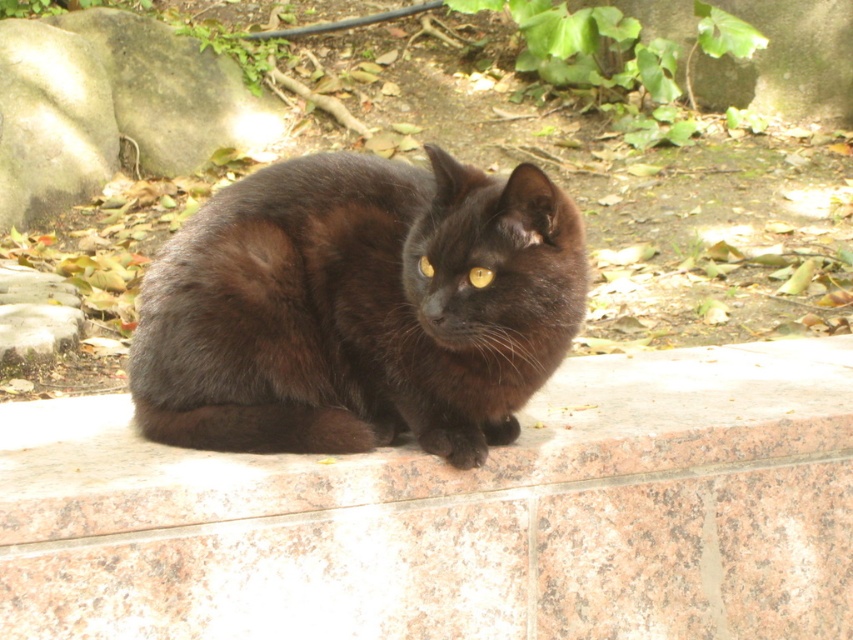
Is pink granite ledge at center smaller than golden shiny eye at center?

Incorrect, pink granite ledge at center is not smaller in size than golden shiny eye at center.

Can you confirm if pink granite ledge at center is positioned to the right of golden shiny eye at center?

Indeed, pink granite ledge at center is positioned on the right side of golden shiny eye at center.

Where is `pink granite ledge at center`? This screenshot has height=640, width=853. pink granite ledge at center is located at coordinates 457,516.

Between point (392, 260) and point (0, 198), which one is positioned in front?

Point (392, 260) is more forward.

Can you confirm if shiny black cat at center is shorter than gray rough rock at upper left?

Yes, shiny black cat at center is shorter than gray rough rock at upper left.

Which is behind, point (332, 253) or point (1, 204)?

Positioned behind is point (1, 204).

I want to click on shiny black cat at center, so click(357, 308).

Who is positioned more to the left, yellow shiny eye at center or golden shiny eye at center?

From the viewer's perspective, golden shiny eye at center appears more on the left side.

Can you confirm if yellow shiny eye at center is bigger than golden shiny eye at center?

Actually, yellow shiny eye at center might be smaller than golden shiny eye at center.

Where is `yellow shiny eye at center`? The width and height of the screenshot is (853, 640). yellow shiny eye at center is located at coordinates (480, 276).